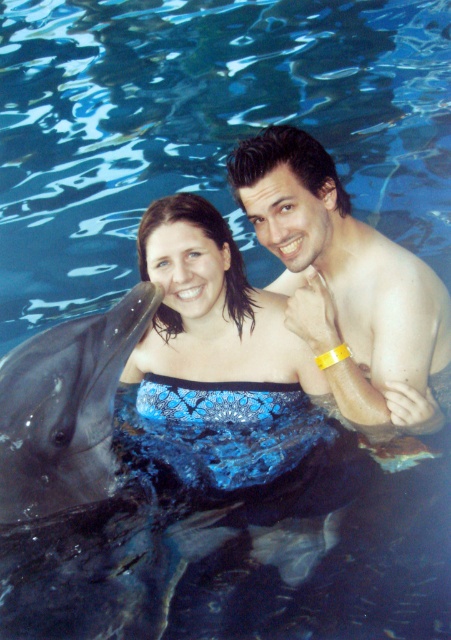
Based on the scene description, where is the smooth skin man at upper right located in terms of coordinates?

The smooth skin man at upper right is located at coordinates point (345,282).